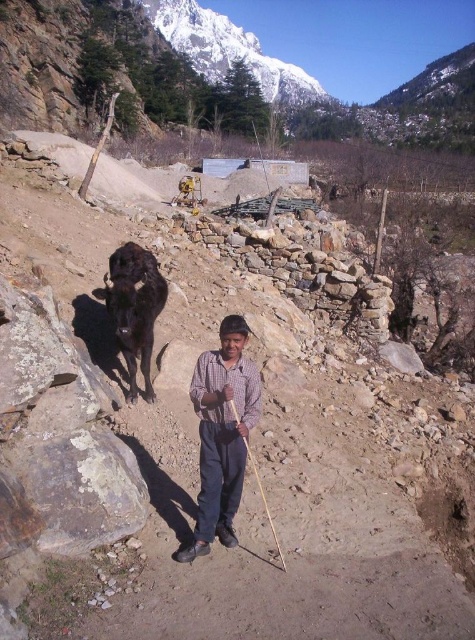
Does point (192, 557) lie behind point (142, 248)?

No, (192, 557) is closer to viewer.

Who is shorter, checkered fabric shirt at center or black glossy yak at center?

Standing shorter between the two is checkered fabric shirt at center.

In the scene shown: Who is more distant from viewer, [199,428] or [130,392]?

The point [130,392] is more distant.

The image size is (475, 640). In order to click on checkered fabric shirt at center in this screenshot , I will do `click(221, 435)`.